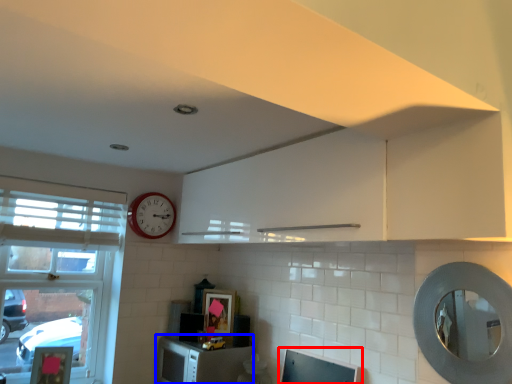
Question: Among these objects, which one is nearest to the camera, computer monitor (highlighted by a red box) or cabinetry (highlighted by a blue box)?

Choices:
 (A) computer monitor
 (B) cabinetry

Answer: (A)